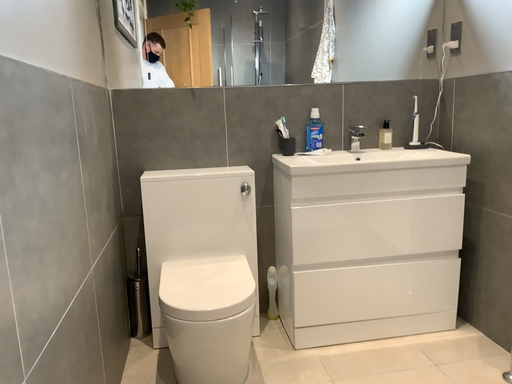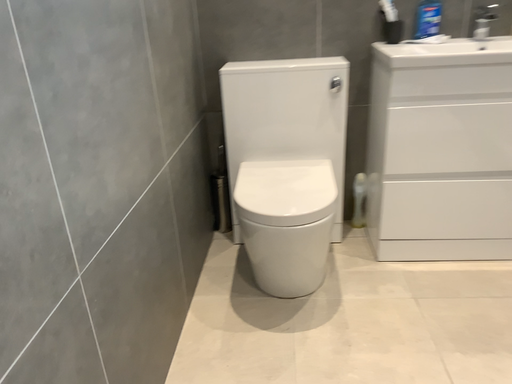
Question: How did the camera likely rotate when shooting the video?

Choices:
 (A) rotated downward
 (B) rotated upward

Answer: (A)